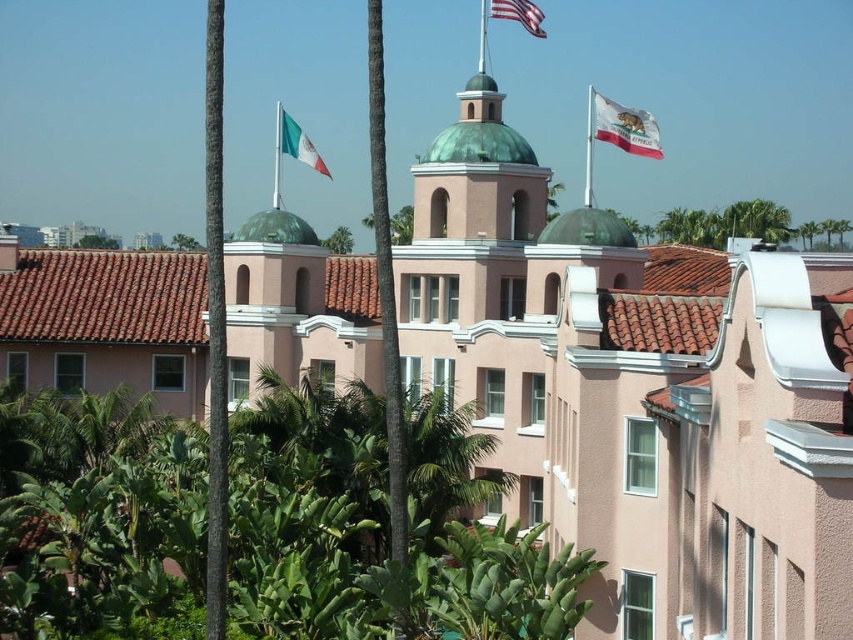
In the scene shown: You are standing in front of the building and see the point marked at coordinates (299, 144). What object is located at that point?

The point at coordinates (299, 144) indicates the green fabric flag at upper center.

You are standing in front of the building and want to hang a new flag between the white fabric flag at upper right and the american flag at upper center. Based on their positions, where should you place the new flag?

The white fabric flag at upper right is below the american flag at upper center, so you should place the new flag between them by positioning it above the white fabric flag at upper right and below the american flag at upper center.

You are standing in front of the building and want to hang a new flag between the green fabric flag at upper center and the american flag at upper center. Which flag should you move to make space?

You should move the american flag at upper center because the green fabric flag at upper center is closer to you, so moving the american flag would allow space between them.